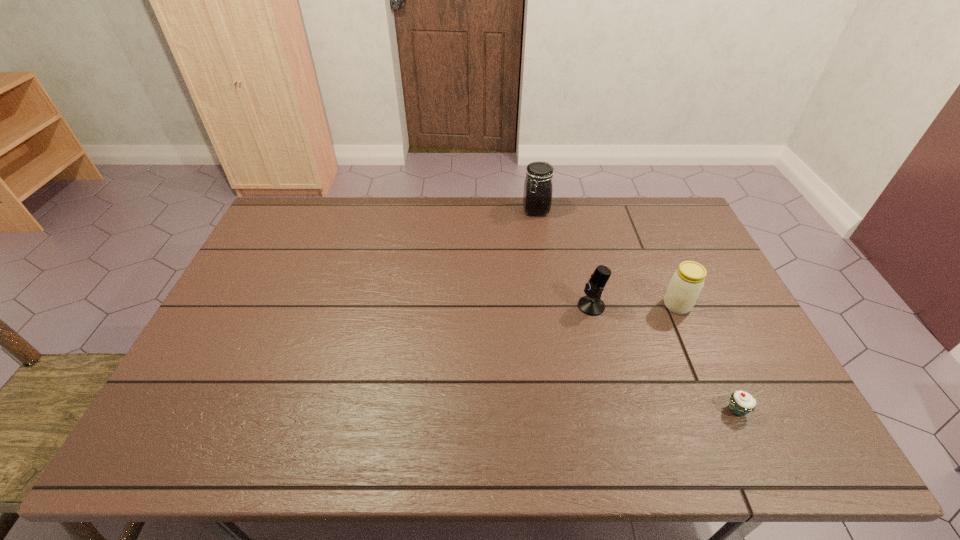
This screenshot has height=540, width=960. In order to click on empty space between the shorter jar and the second object from left to right in this screenshot , I will do `click(635, 306)`.

Select which object is the second closest to the leftmost object. Please provide its 2D coordinates. Your answer should be formatted as a tuple, i.e. [(x, y)], where the tuple contains the x and y coordinates of a point satisfying the conditions above.

[(686, 284)]

Select which object appears as the second closest to the nearest object. Please provide its 2D coordinates. Your answer should be formatted as a tuple, i.e. [(x, y)], where the tuple contains the x and y coordinates of a point satisfying the conditions above.

[(591, 304)]

This screenshot has width=960, height=540. Find the location of `free space that satisfies the following two spatial constraints: 1. on the stand of the microphone; 2. on the right side of the cupcake`. free space that satisfies the following two spatial constraints: 1. on the stand of the microphone; 2. on the right side of the cupcake is located at coordinates (616, 409).

Identify the location of vacant space that satisfies the following two spatial constraints: 1. on the stand of the shortest object; 2. on the left side of the second object from left to right. (616, 409).

The width and height of the screenshot is (960, 540). Identify the location of free space in the image that satisfies the following two spatial constraints: 1. on the stand of the cupcake; 2. on the left side of the microphone. (616, 409).

Identify the location of free location that satisfies the following two spatial constraints: 1. on the front side of the nearest object; 2. on the left side of the right jar. The image size is (960, 540). (723, 409).